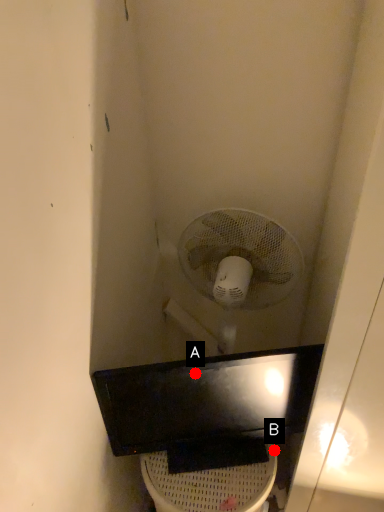
Question: Two points are circled on the image, labeled by A and B beside each circle. Which of the following is the closest to the observer?

Choices:
 (A) A is closer
 (B) B is closer

Answer: (A)